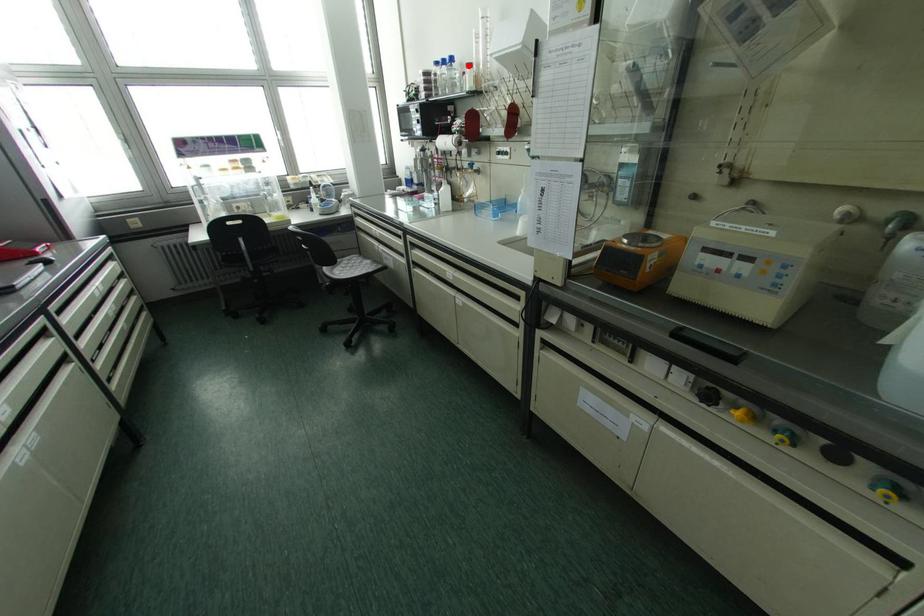
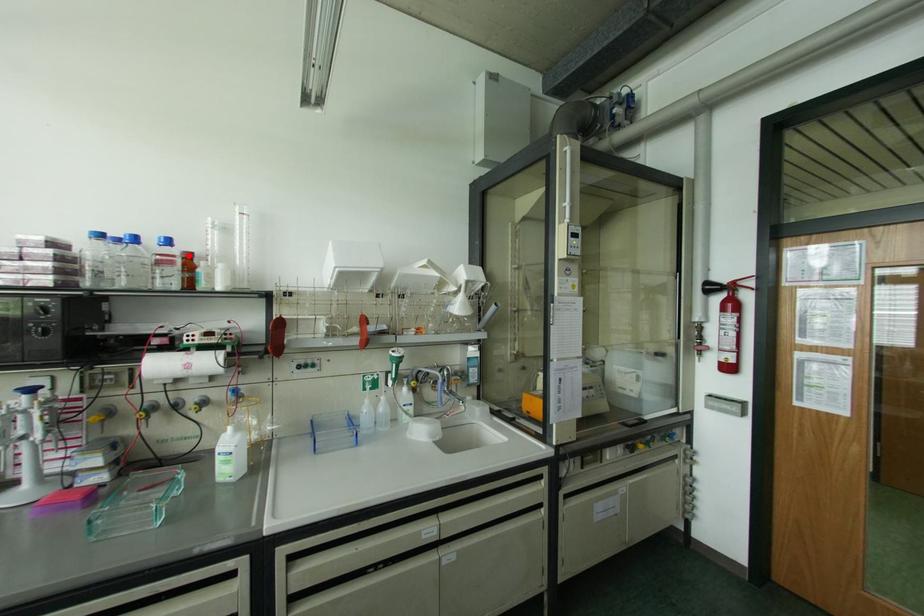
I am providing you with two images of the same scene from different viewpoints. A red point is marked on the first image and another point is marked on the second image. Is the marked point in image1 the same physical position as the marked point in image2?

Yes